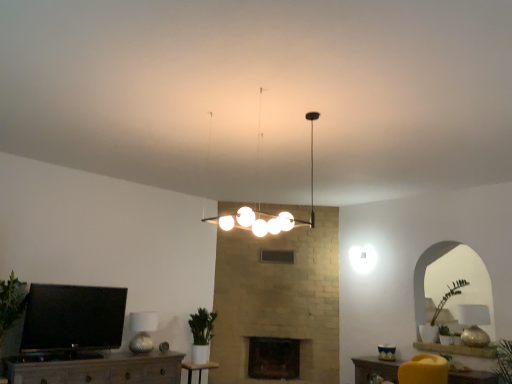
Question: Considering the relative positions of matte wood tv stand at lower left, positioned as the 1th furniture in left-to-right order, and matte wood table at lower center, which appears as the 1th table when viewed from the top, in the image provided, is matte wood tv stand at lower left, positioned as the 1th furniture in left-to-right order, to the left or to the right of matte wood table at lower center, which appears as the 1th table when viewed from the top,?

Choices:
 (A) left
 (B) right

Answer: (A)

Question: From a real-world perspective, is matte wood tv stand at lower left, positioned as the 1th furniture in left-to-right order, positioned above or below matte wood table at lower center, which ranks as the second table in back-to-front order?

Choices:
 (A) above
 (B) below

Answer: (B)

Question: Estimate the real-world distances between objects in this image. Which object is farther from the matte wood table at lower center, which appears as the 1th table when viewed from the top?

Choices:
 (A) green matte plant at center
 (B) dark stone fireplace at center
 (C) gold textured lampshade at right, which appears as the 1th lamp when viewed from the right
 (D) matte wood tv stand at lower left, positioned as the 1th furniture in left-to-right order
 (E) velvet yellow armchair at lower right, which appears as the first furniture when viewed from the right

Answer: (D)

Question: Based on their relative distances, which object is farther from the white glossy light fixture at center, the 2th lamp in the right-to-left sequence?

Choices:
 (A) matte wood table at lower center, arranged as the 1th table when viewed from the right
 (B) matte wood tv stand at lower left, the 2th furniture viewed from the right
 (C) wooden table at center, the first table when ordered from bottom to top
 (D) gold textured lampshade at right, arranged as the second lamp when viewed from the back
 (E) metallic textured lampshade at lower left, placed as the first lamp when sorted from back to front

Answer: (A)